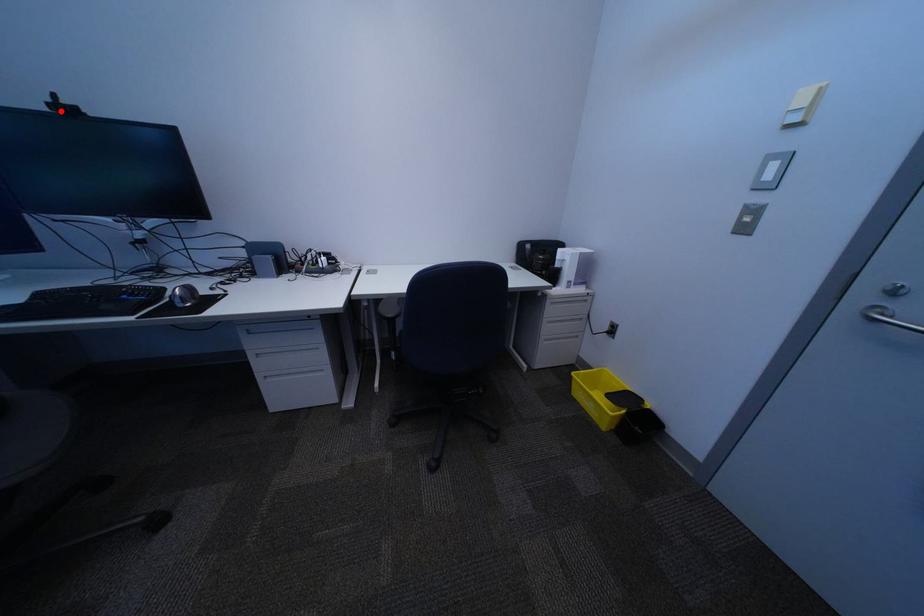
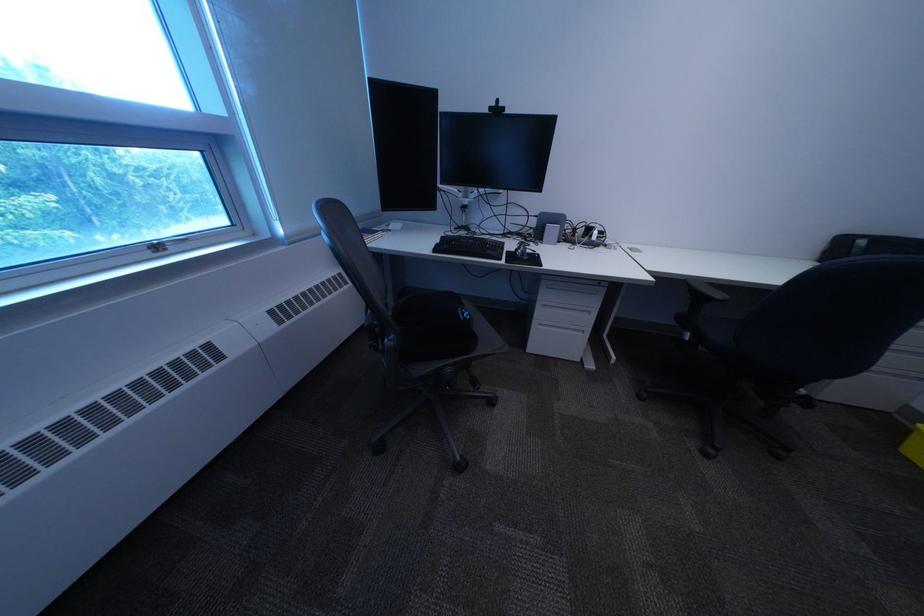
Question: I am providing you with two images of the same scene from different viewpoints. Image1 has a red point marked. In image2, the corresponding 3D location appears at what relative position? Reply with the corresponding letter.

Choices:
 (A) Closer
 (B) Farther

Answer: (A)